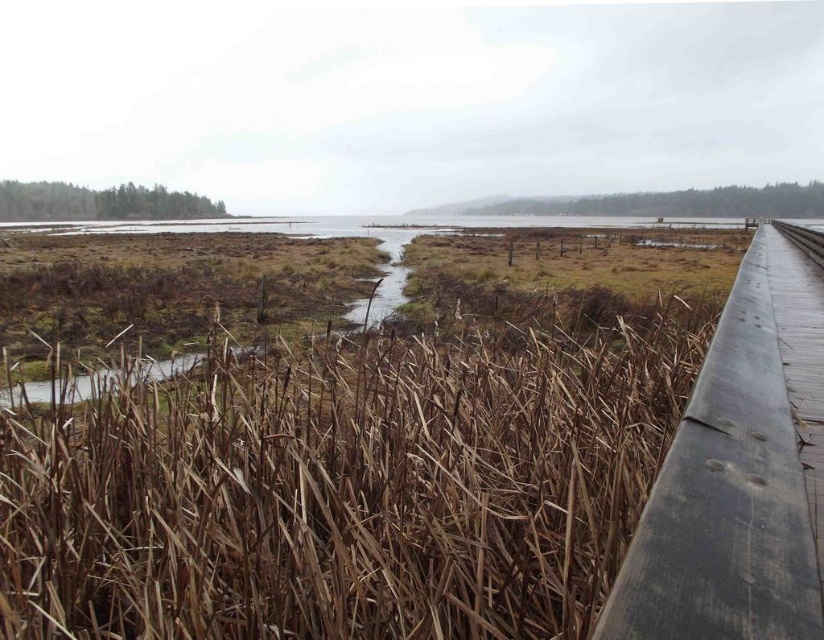
You are a photographer setting up a tripod on the wooden boardwalk. You want to frame a shot that includes both the brown dry reed at lower right and the wooden rail at right. Which object should you position closer to the edge of your frame to ensure both fit within the shot?

Since the brown dry reed at lower right is narrower than the wooden rail at right, you should position the wider wooden rail at right closer to the edge of the frame to accommodate its greater width within the shot.

You are a hiker who wants to walk along the boardwalk but needs to avoid the brown dry reed at lower right. Which direction should you move to stay clear of it while staying on the wooden at right?

The brown dry reed at lower right is positioned on the left side of wooden at right. To avoid it, move to the right side of the wooden at right.

You are standing on the wooden boardwalk in the wetland scene. You notice a wooden rail at point (738, 476). Which direction should you walk to stay on the boardwalk and avoid the wetland?

The wooden rail at right is located at point (738, 476). To stay on the boardwalk and avoid the wetland, you should walk towards the left since the boardwalk curves gently towards the center from the bottom right corner, and the rail is on the right side indicating the boardwalk direction.